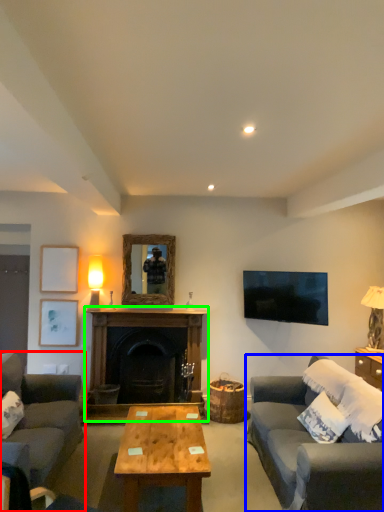
Question: Based on their relative distances, which object is farther from studio couch (highlighted by a red box)? Choose from studio couch (highlighted by a blue box) and fireplace (highlighted by a green box).

Choices:
 (A) studio couch
 (B) fireplace

Answer: (A)